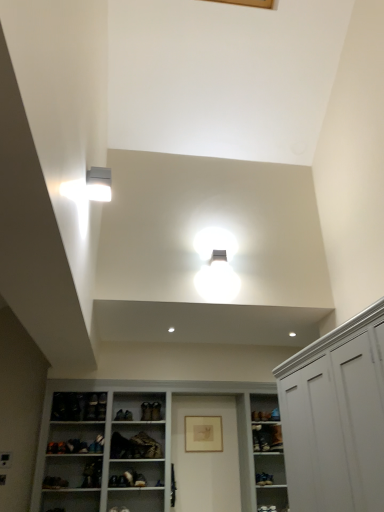
Question: Considering the relative positions of white matte cabinet at right and leather shoe at center, the first shoe when ordered from right to left, in the image provided, is white matte cabinet at right to the right of leather shoe at center, the first shoe when ordered from right to left, from the viewer's perspective?

Choices:
 (A) no
 (B) yes

Answer: (B)

Question: Is white matte cabinet at right placed right next to leather shoe at center, which is the second shoe from left to right?

Choices:
 (A) no
 (B) yes

Answer: (A)

Question: From the image's perspective, would you say white matte cabinet at right is shown under leather shoe at center, which is the second shoe from left to right?

Choices:
 (A) yes
 (B) no

Answer: (B)

Question: Is white matte cabinet at right wider than leather shoe at center, the first shoe when ordered from right to left?

Choices:
 (A) no
 (B) yes

Answer: (B)

Question: Is white matte cabinet at right smaller than leather shoe at center, which is the second shoe from left to right?

Choices:
 (A) yes
 (B) no

Answer: (B)

Question: Relative to white matte cabinet at right, is leather at center, acting as the second shoe starting from the right, in front or behind?

Choices:
 (A) behind
 (B) front

Answer: (A)

Question: From the image's perspective, is leather at center, acting as the second shoe starting from the right, located above or below white matte cabinet at right?

Choices:
 (A) below
 (B) above

Answer: (A)

Question: Is leather at center, acting as the second shoe starting from the right, inside or outside of white matte cabinet at right?

Choices:
 (A) outside
 (B) inside

Answer: (A)

Question: Visually, is leather at center, acting as the second shoe starting from the right, positioned to the left or to the right of white matte cabinet at right?

Choices:
 (A) right
 (B) left

Answer: (B)

Question: Is leather at center, acting as the second shoe starting from the right, taller or shorter than leather shoe at center, which is the second shoe from left to right?

Choices:
 (A) short
 (B) tall

Answer: (A)

Question: Is leather at center, the 1th shoe when ordered from left to right, bigger or smaller than leather shoe at center, the first shoe when ordered from right to left?

Choices:
 (A) small
 (B) big

Answer: (B)

Question: Considering the positions of leather at center, acting as the second shoe starting from the right, and leather shoe at center, which is the second shoe from left to right, in the image, is leather at center, acting as the second shoe starting from the right, wider or thinner than leather shoe at center, which is the second shoe from left to right,?

Choices:
 (A) thin
 (B) wide

Answer: (A)

Question: From a real-world perspective, is leather at center, acting as the second shoe starting from the right, positioned above or below leather shoe at center, the first shoe when ordered from right to left?

Choices:
 (A) above
 (B) below

Answer: (B)

Question: Considering their positions, is matte gold picture frame at center located in front of or behind white plastic light fixture at upper left?

Choices:
 (A) behind
 (B) front

Answer: (A)

Question: From their relative heights in the image, would you say matte gold picture frame at center is taller or shorter than white plastic light fixture at upper left?

Choices:
 (A) tall
 (B) short

Answer: (A)